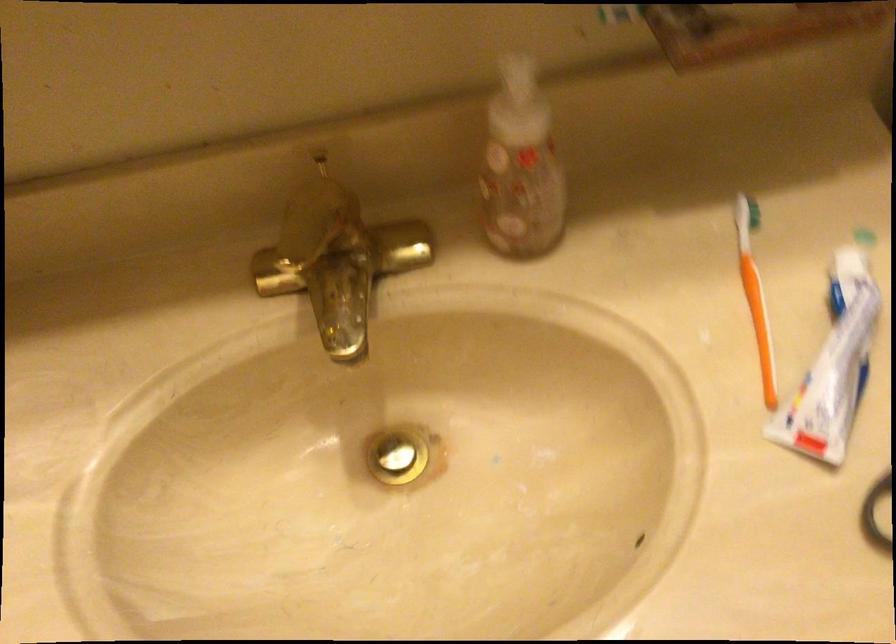
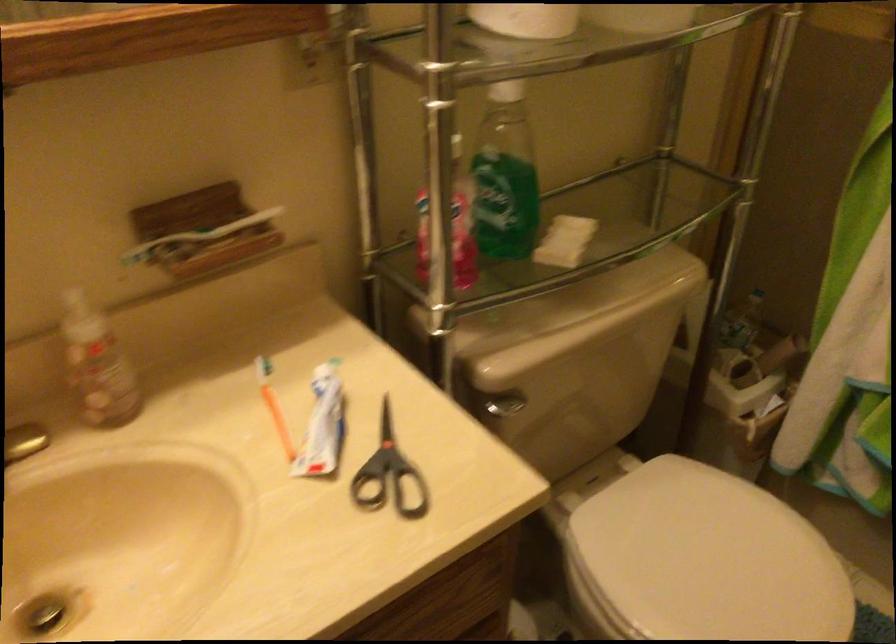
Where in the second image is the point corresponding to (521,176) from the first image?

(97, 364)